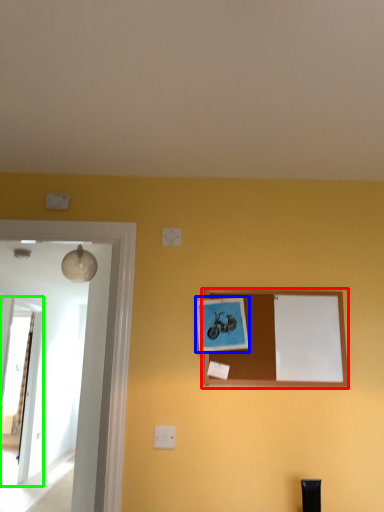
Question: Considering the real-world distances, which object is farthest from picture frame (highlighted by a red box)? picture frame (highlighted by a blue box) or glass door (highlighted by a green box)?

Choices:
 (A) picture frame
 (B) glass door

Answer: (B)